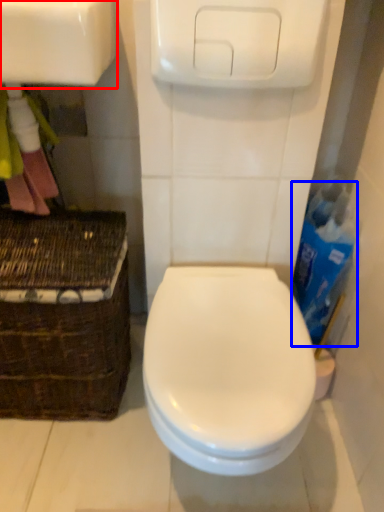
Question: Which of the following is the farthest to the observer, sink (highlighted by a red box) or cleaning product (highlighted by a blue box)?

Choices:
 (A) sink
 (B) cleaning product

Answer: (B)